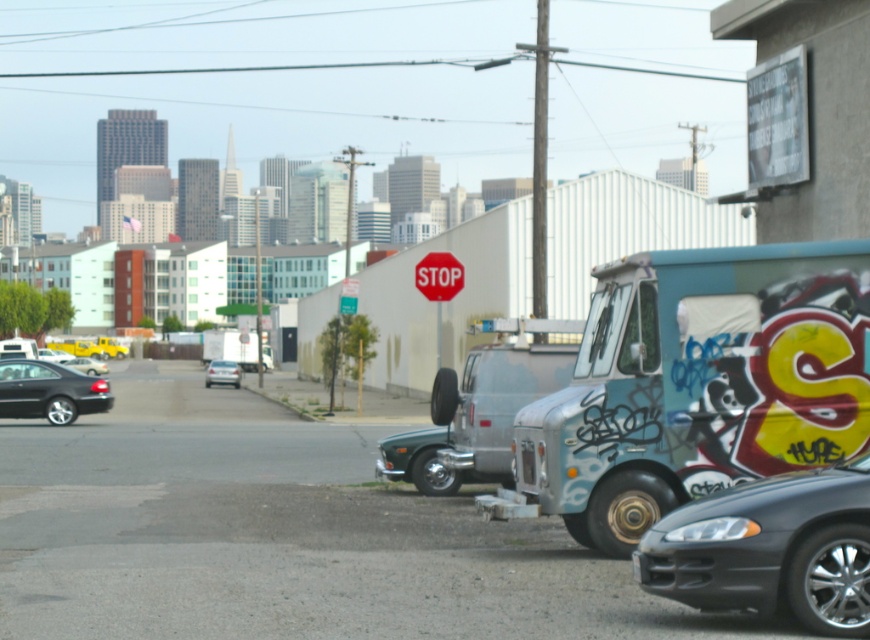
Question: Estimate the real-world distances between objects in this image. Which object is farther from the teal graffiti-covered van at right?

Choices:
 (A) shiny black car at lower right
 (B) shiny black sedan at center
 (C) metallic green car at center
 (D) red matte stop sign at center

Answer: (B)

Question: Which point appears farthest from the camera in this image?

Choices:
 (A) (671, 596)
 (B) (422, 486)
 (C) (453, 273)

Answer: (C)

Question: Does shiny black sedan at lower left come behind shiny black sedan at center?

Choices:
 (A) yes
 (B) no

Answer: (B)

Question: Which object is positioned farthest from the shiny black sedan at center?

Choices:
 (A) teal graffiti-covered van at right
 (B) red matte stop sign at center
 (C) shiny black car at lower right

Answer: (C)

Question: Is red matte stop sign at center smaller than shiny black sedan at center?

Choices:
 (A) no
 (B) yes

Answer: (B)

Question: Considering the relative positions of silver metallic sedan at center and shiny black sedan at center in the image provided, where is silver metallic sedan at center located with respect to shiny black sedan at center?

Choices:
 (A) above
 (B) below

Answer: (B)